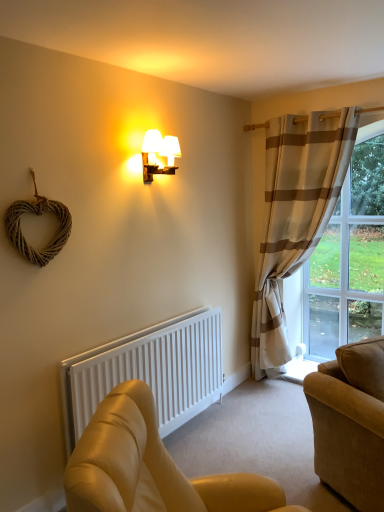
I want to click on vacant space in front of beige striped curtain at right, so click(281, 422).